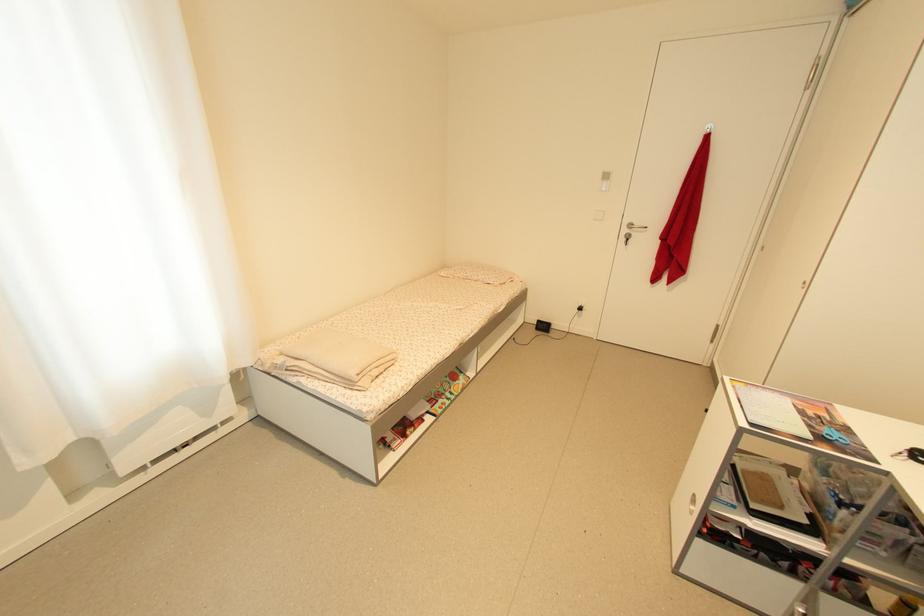
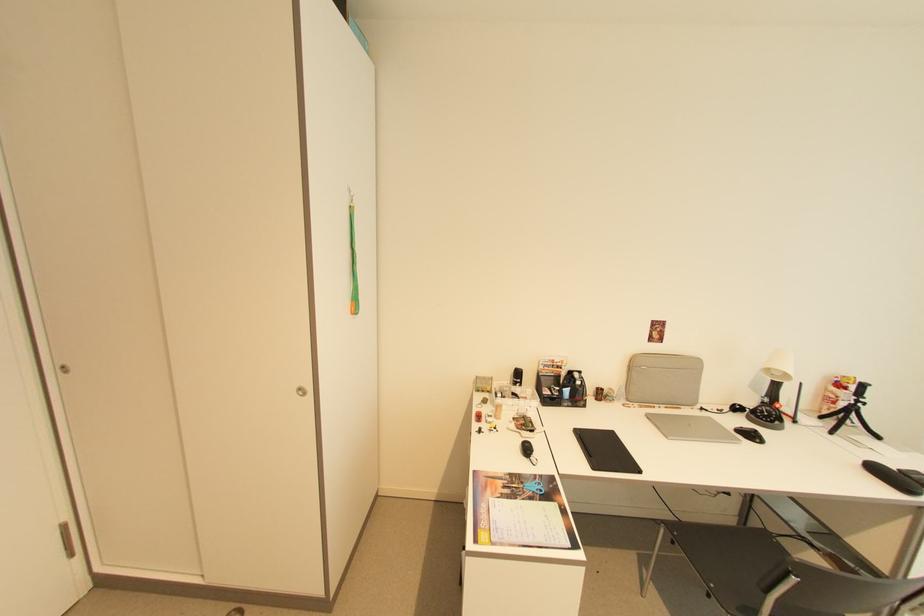
Find the pixel in the second image that matches the point at 829,416 in the first image.

(505, 484)